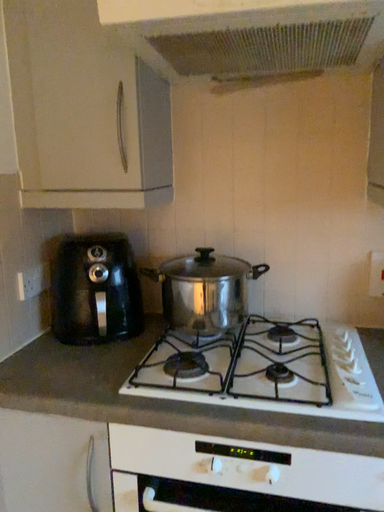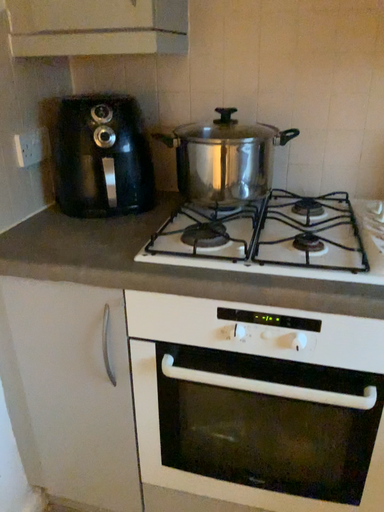
Question: How did the camera likely rotate when shooting the video?

Choices:
 (A) rotated upward
 (B) rotated downward

Answer: (B)